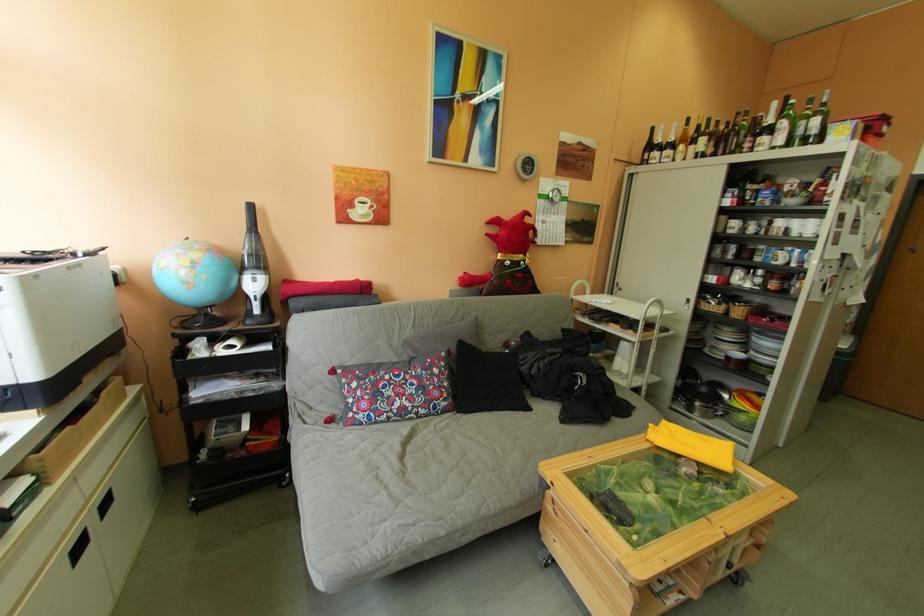
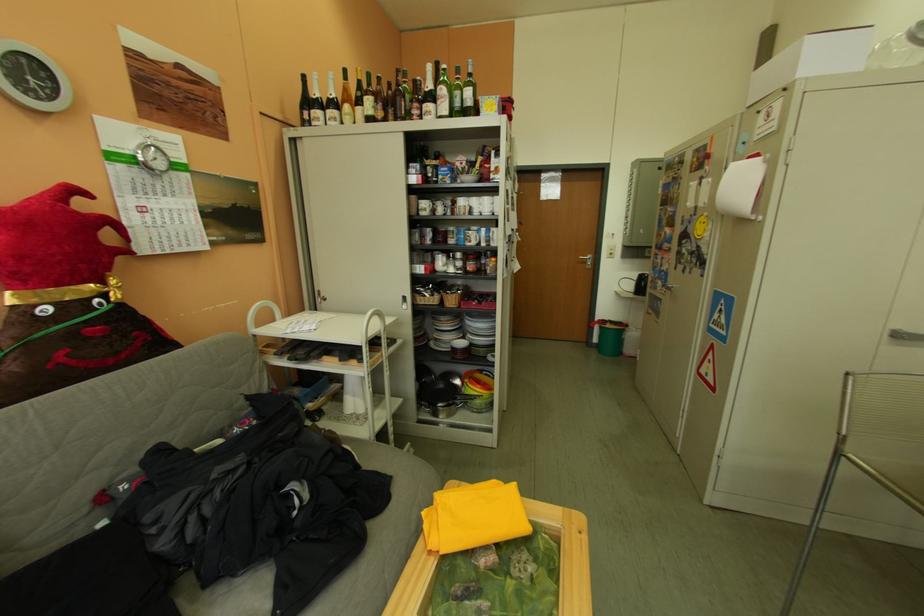
Where in the second image is the point corresponding to point (736, 220) from the first image?

(427, 201)